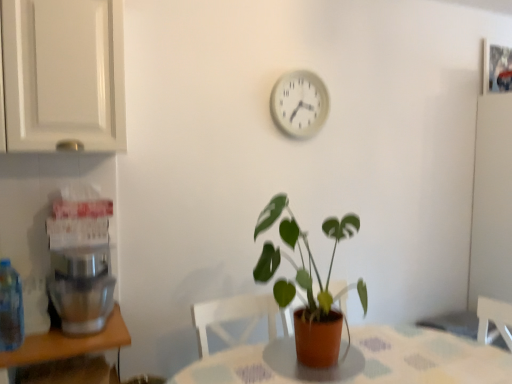
Question: Could translucent plastic bottle at left be considered to be inside white plastic clock at upper center?

Choices:
 (A) yes
 (B) no

Answer: (B)

Question: Is white plastic clock at upper center not near translucent plastic bottle at left?

Choices:
 (A) no
 (B) yes

Answer: (B)

Question: Is white plastic clock at upper center positioned in front of translucent plastic bottle at left?

Choices:
 (A) no
 (B) yes

Answer: (A)

Question: Is white plastic clock at upper center outside translucent plastic bottle at left?

Choices:
 (A) yes
 (B) no

Answer: (A)

Question: Is white plastic clock at upper center shorter than translucent plastic bottle at left?

Choices:
 (A) yes
 (B) no

Answer: (B)

Question: From their relative heights in the image, would you say white plastic clock at upper center is taller or shorter than patterned fabric table at center?

Choices:
 (A) tall
 (B) short

Answer: (B)

Question: Considering the positions of white plastic clock at upper center and patterned fabric table at center in the image, is white plastic clock at upper center bigger or smaller than patterned fabric table at center?

Choices:
 (A) small
 (B) big

Answer: (A)

Question: From a real-world perspective, is white plastic clock at upper center above or below patterned fabric table at center?

Choices:
 (A) above
 (B) below

Answer: (A)

Question: In the image, is white plastic clock at upper center on the left side or the right side of patterned fabric table at center?

Choices:
 (A) right
 (B) left

Answer: (B)

Question: Is green matte plant at center wider or thinner than white glossy cabinet at upper left?

Choices:
 (A) thin
 (B) wide

Answer: (B)

Question: Is green matte plant at center taller or shorter than white glossy cabinet at upper left?

Choices:
 (A) short
 (B) tall

Answer: (B)

Question: In the image, is green matte plant at center positioned in front of or behind white glossy cabinet at upper left?

Choices:
 (A) behind
 (B) front

Answer: (A)

Question: From a real-world perspective, is green matte plant at center positioned above or below white glossy cabinet at upper left?

Choices:
 (A) below
 (B) above

Answer: (A)

Question: Is green matte plant at center to the left or to the right of translucent plastic bottle at left in the image?

Choices:
 (A) right
 (B) left

Answer: (A)

Question: Is green matte plant at center situated inside translucent plastic bottle at left or outside?

Choices:
 (A) inside
 (B) outside

Answer: (B)